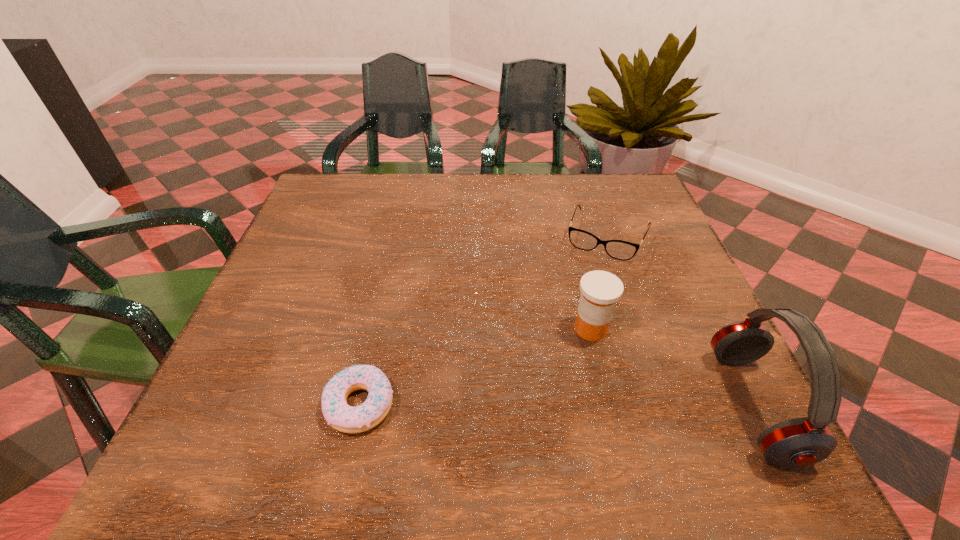
Locate an element on the screen. The height and width of the screenshot is (540, 960). free location that satisfies the following two spatial constraints: 1. on the back side of the doughnut; 2. on the right side of the third shortest object is located at coordinates tap(377, 329).

Find the location of a particular element. blank space that satisfies the following two spatial constraints: 1. on the back side of the leftmost object; 2. on the left side of the spectacles is located at coordinates (397, 238).

Find the location of a particular element. The height and width of the screenshot is (540, 960). vacant space that satisfies the following two spatial constraints: 1. on the front side of the spectacles; 2. on the ear cups of the earphone is located at coordinates (663, 405).